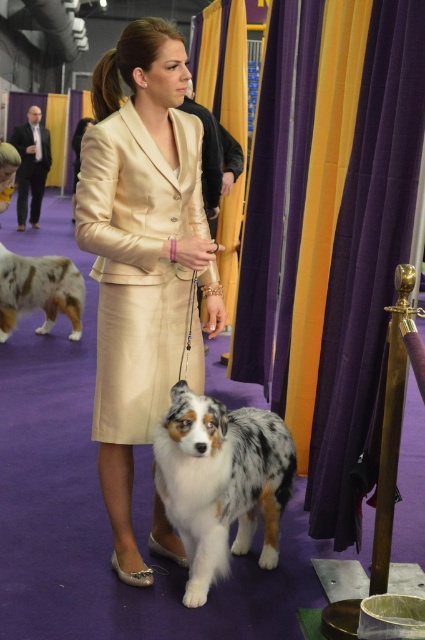
You are a photographer at the dog show and need to position your camera to capture both the gold shiny suit at center and the white and brown fur at center in the same frame. Which object should you focus on first to ensure both are in view?

You should focus on the white and brown fur at center first because the gold shiny suit at center is below it, so by centering the white and brown fur, the gold shiny suit will naturally fall into the frame below.

You are a photographer at the dog show and need to capture a photo that includes both the white and brown fur at center and the matte black suit at left. Based on their positions, which object should you place on the right side of your camera frame?

The white and brown fur at center should be placed on the right side of your camera frame because it is positioned on the right side of the matte black suit at left according to the description.

In the scene shown: You are a photographer at a dog show and need to position a camera to capture both the gold shiny suit at center and the white and brown fur at center in the same frame. Given that the camera has a fixed focal length, which object should you focus on first to ensure both are in frame?

The gold shiny suit at center is narrower than the white and brown fur at center, so you should focus on the wider white and brown fur at center first to ensure both fit within the frame.